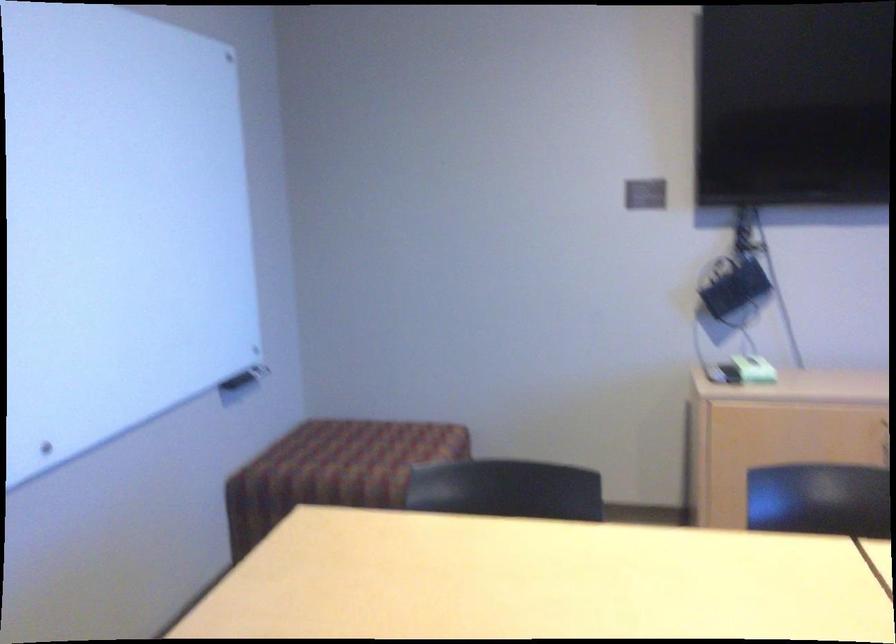
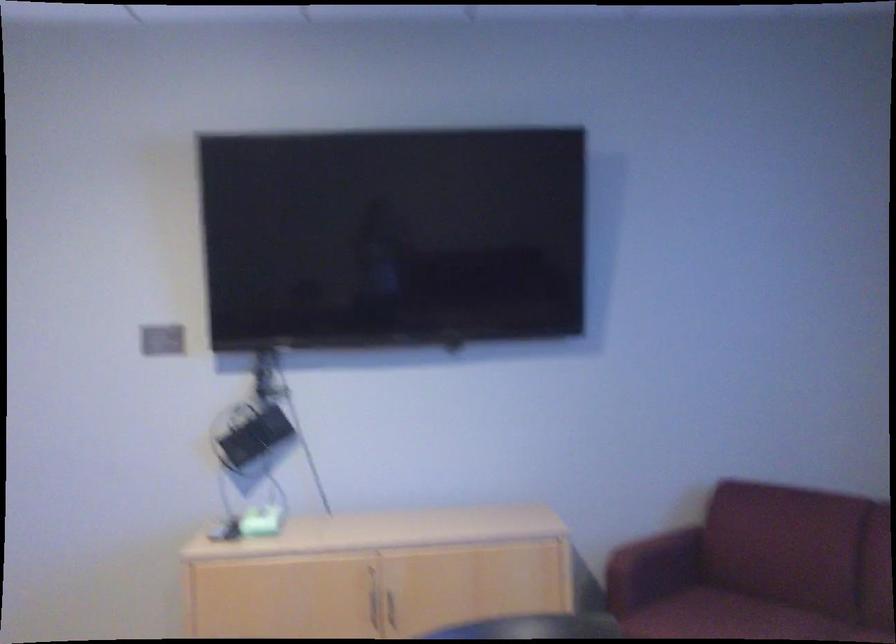
Question: The images are taken continuously from a first-person perspective. In which direction is your viewpoint rotating?

Choices:
 (A) Left
 (B) Right
 (C) Up
 (D) Down

Answer: (B)